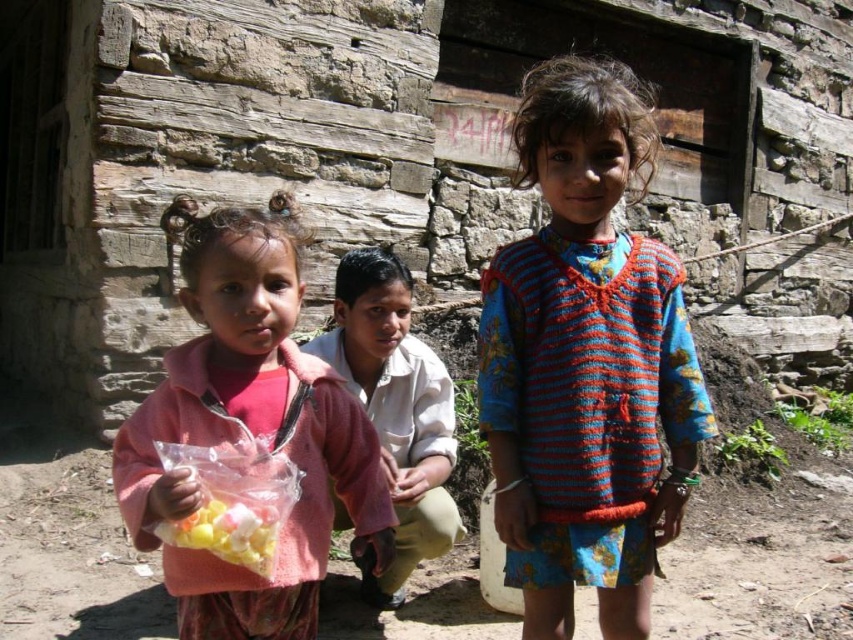
Question: Which point is farther to the camera?

Choices:
 (A) knitted wool sweater at center
 (B) translucent plastic bag of colorful candies at lower left
 (C) pink fabric at center
 (D) light beige cotton shirt at center

Answer: (D)

Question: Where is knitted wool sweater at center located in relation to translucent plastic bag of colorful candies at lower left in the image?

Choices:
 (A) above
 (B) below

Answer: (A)

Question: Which point is closer to the camera?

Choices:
 (A) (384, 403)
 (B) (309, 385)
 (C) (602, 605)
 (D) (202, 538)

Answer: (D)

Question: Does pink fabric at center appear under translucent plastic bag of colorful candies at lower left?

Choices:
 (A) yes
 (B) no

Answer: (B)

Question: Which point appears farthest from the camera in this image?

Choices:
 (A) (672, 400)
 (B) (390, 509)

Answer: (A)

Question: Can you confirm if pink fabric at center is positioned above translucent plastic bag of colorful candies at lower left?

Choices:
 (A) no
 (B) yes

Answer: (B)